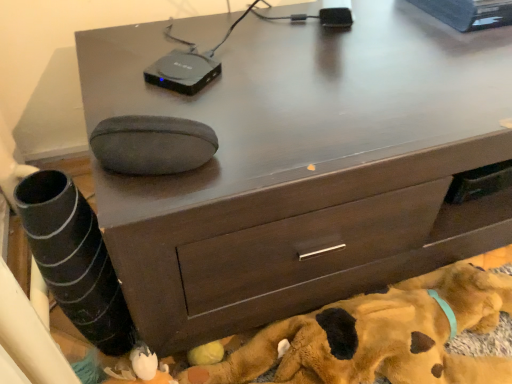
Question: Considering the positions of black plastic device at upper center and brown plush dog at lower center in the image, is black plastic device at upper center bigger or smaller than brown plush dog at lower center?

Choices:
 (A) big
 (B) small

Answer: (B)

Question: In the image, is black plastic device at upper center on the left side or the right side of brown plush dog at lower center?

Choices:
 (A) right
 (B) left

Answer: (B)

Question: Considering their positions, is black plastic device at upper center located in front of or behind brown plush dog at lower center?

Choices:
 (A) front
 (B) behind

Answer: (B)

Question: From their relative heights in the image, would you say brown plush dog at lower center is taller or shorter than black plastic device at upper center?

Choices:
 (A) tall
 (B) short

Answer: (A)

Question: Considering the positions of point (217, 372) and point (183, 82), is point (217, 372) closer or farther from the camera than point (183, 82)?

Choices:
 (A) closer
 (B) farther

Answer: (B)

Question: Is brown plush dog at lower center inside the boundaries of black plastic device at upper center, or outside?

Choices:
 (A) inside
 (B) outside

Answer: (B)

Question: From a real-world perspective, is brown plush dog at lower center physically located above or below black plastic device at upper center?

Choices:
 (A) above
 (B) below

Answer: (B)